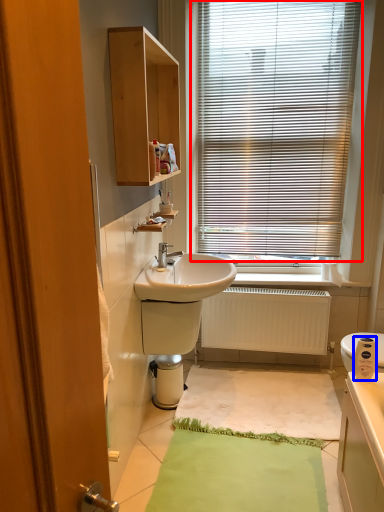
Question: Which of the following is the closest to the observer, window blind (highlighted by a red box) or appliance (highlighted by a blue box)?

Choices:
 (A) window blind
 (B) appliance

Answer: (B)